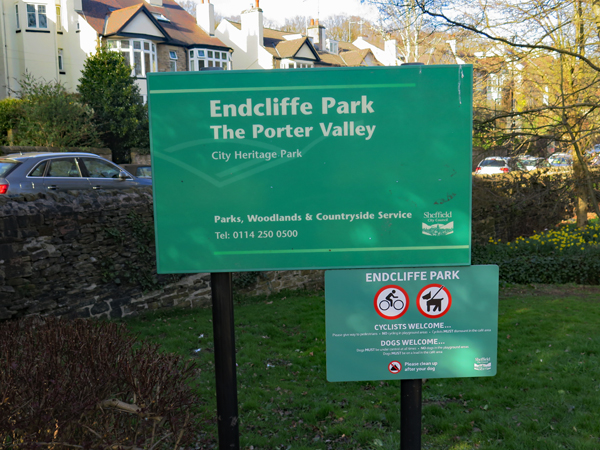
Locate an element on the screen. chimneys is located at coordinates (455, 42), (391, 44), (316, 31), (250, 17), (205, 6).